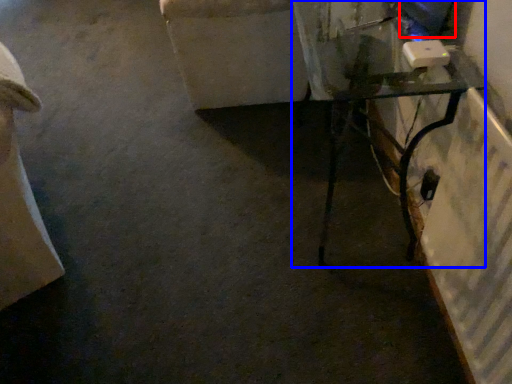
Question: Among these objects, which one is farthest to the camera, computer screen (highlighted by a red box) or table (highlighted by a blue box)?

Choices:
 (A) computer screen
 (B) table

Answer: (A)